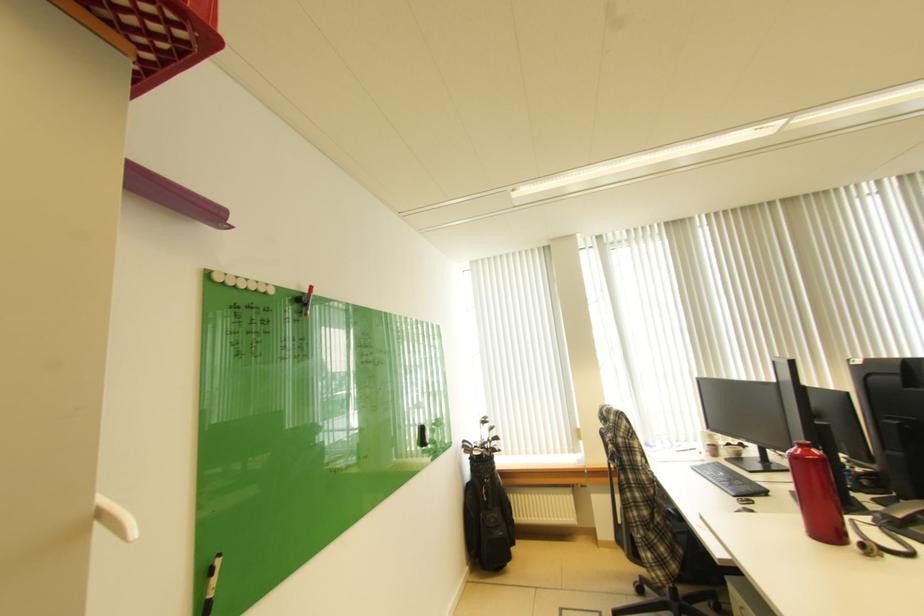
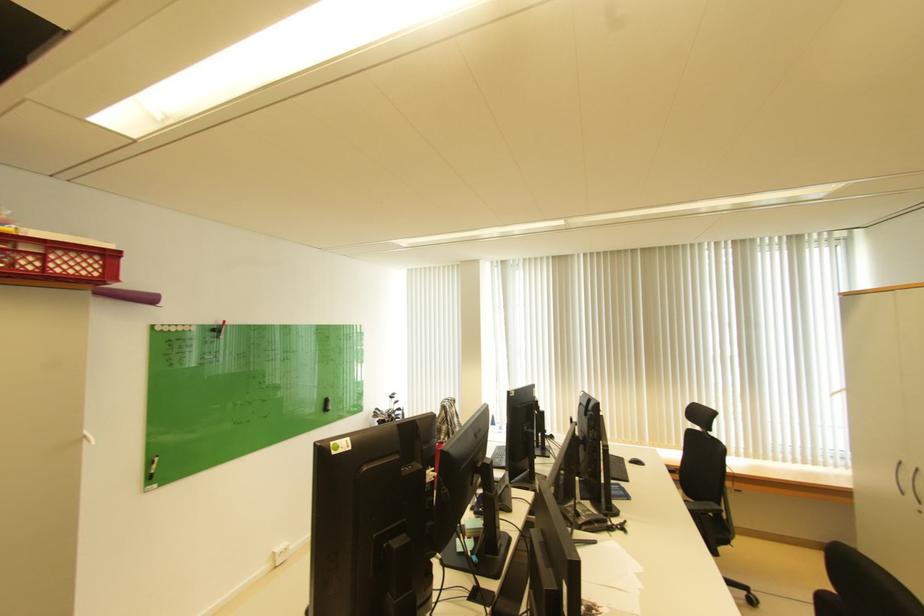
What movement of the cameraman would produce the second image?

The cameraman moved toward right, backward.